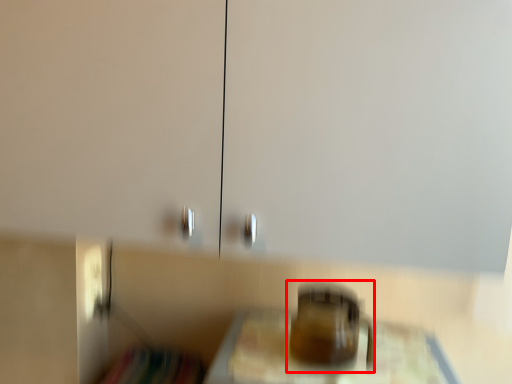
Question: From the image's perspective, considering the relative positions of appliance (annotated by the red box) and furniture in the image provided, where is appliance (annotated by the red box) located with respect to the staircase?

Choices:
 (A) below
 (B) above

Answer: (B)